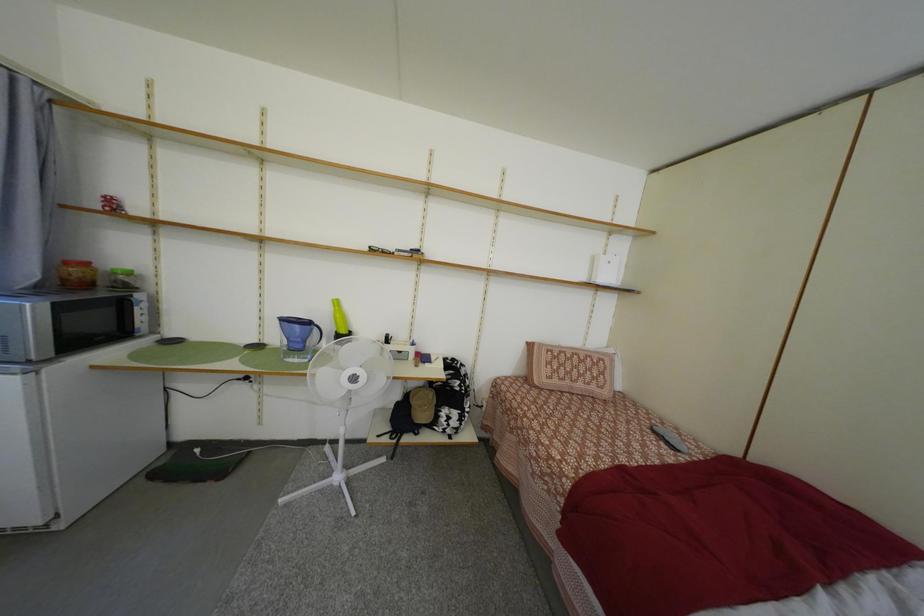
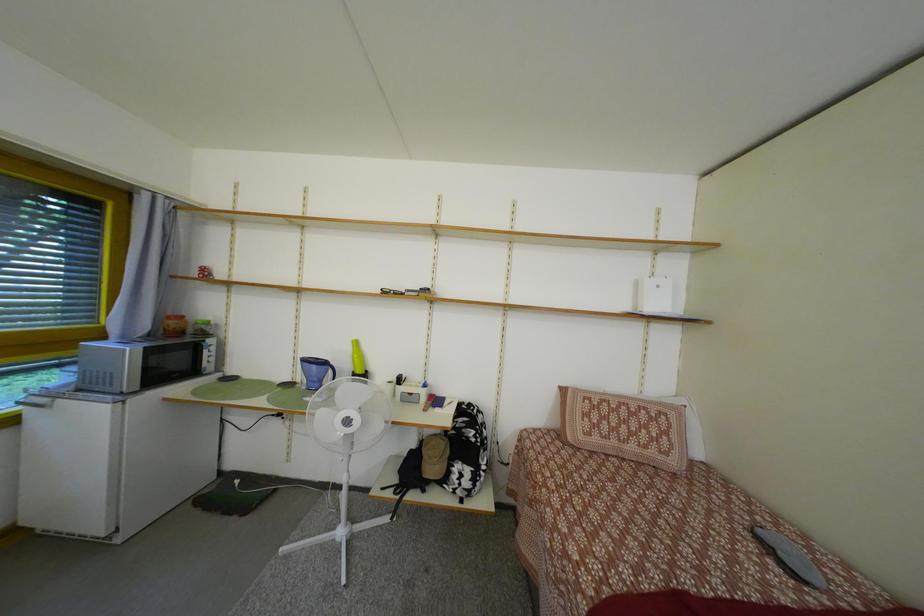
Which direction would the cameraman need to move to produce the second image?

The movement direction of the cameraman is right, forward.